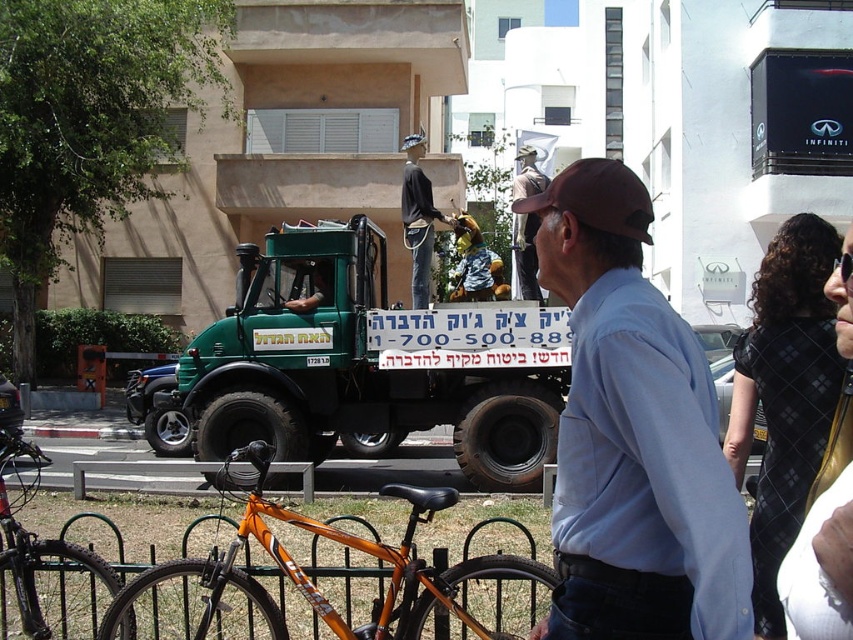
Question: Among these points, which one is farthest from the camera?

Choices:
 (A) (10, 452)
 (B) (531, 264)

Answer: (B)

Question: Does orange matte bicycle at lower center lie behind orange matte bicycle at lower left?

Choices:
 (A) no
 (B) yes

Answer: (A)

Question: Considering the real-world distances, which object is farthest from the green matte truck at center?

Choices:
 (A) light blue shirt at center
 (B) orange matte bicycle at lower center

Answer: (A)

Question: In this image, where is light blue shirt at center located relative to brown fabric baseball cap at upper center?

Choices:
 (A) below
 (B) above

Answer: (A)

Question: Among these points, which one is nearest to the camera?

Choices:
 (A) (775, 252)
 (B) (293, 244)
 (C) (682, 593)
 (D) (515, 193)

Answer: (C)

Question: Can you confirm if green matte truck at center is thinner than orange matte bicycle at lower center?

Choices:
 (A) yes
 (B) no

Answer: (B)